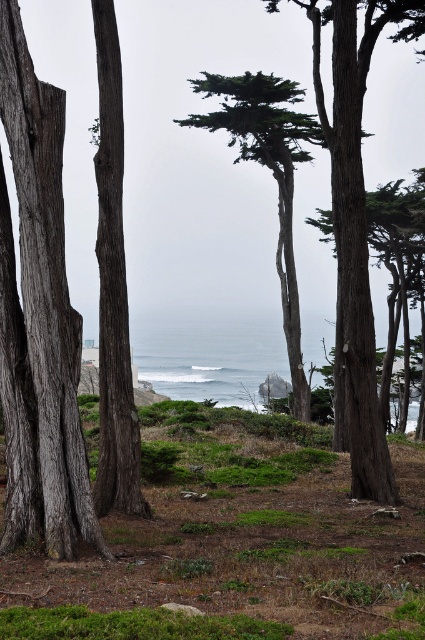
Question: Does gray rough bark tree at left lie behind green grassy at lower center?

Choices:
 (A) no
 (B) yes

Answer: (B)

Question: Which object is closer to the camera taking this photo?

Choices:
 (A) green grassy at lower center
 (B) gray rough bark tree at left
 (C) smooth gray bark tree at left
 (D) smooth bark tree at center

Answer: (A)

Question: Which point is farther from the camera taking this photo?

Choices:
 (A) (215, 81)
 (B) (108, 632)

Answer: (A)

Question: Which point is farther to the camera?

Choices:
 (A) (385, 417)
 (B) (295, 97)

Answer: (B)

Question: Can you confirm if smooth gray bark tree at left is bigger than green textured tree at center?

Choices:
 (A) no
 (B) yes

Answer: (A)

Question: Does gray rough bark tree at left appear on the right side of smooth bark tree at center?

Choices:
 (A) yes
 (B) no

Answer: (B)